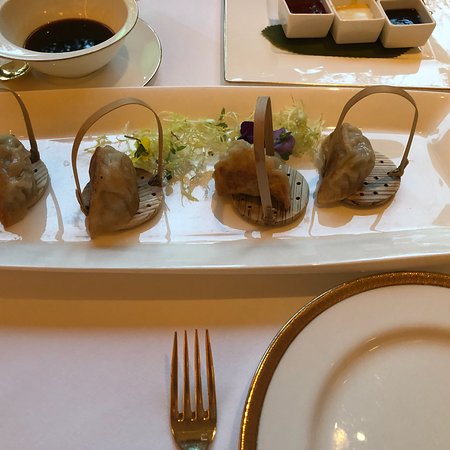
Identify the location of `table. (169, 50).